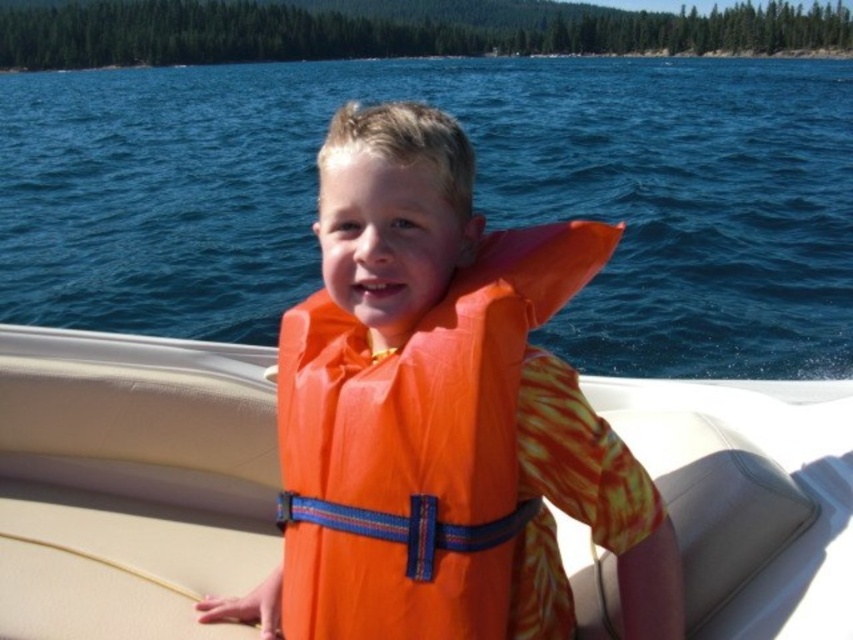
Does point (635, 276) come closer to viewer compared to point (846, 477)?

That is False.

Is orange life vest at center further to camera compared to orange fabric life vest at center?

No, it is not.

Is point (772, 156) behind point (45, 330)?

That is True.

The height and width of the screenshot is (640, 853). What are the coordinates of `orange life vest at center` in the screenshot? It's located at (474, 196).

Between point (509, 248) and point (792, 400), which one is positioned in front?

Point (509, 248)

Does point (544, 253) come behind point (115, 424)?

No, (544, 253) is closer to viewer.

In the scene shown: Measure the distance between point (445, 282) and camera.

1.74 meters

At what (x,y) coordinates should I click in order to perform the action: click on orange rubber life vest at center. Please return your answer as a coordinate pair (x, y). This screenshot has width=853, height=640. Looking at the image, I should click on coord(413,401).

From the picture: Which is below, orange life vest at center or orange rubber life vest at center?

orange rubber life vest at center

Does point (155, 97) lie in front of point (289, 560)?

No.

Where is `orange life vest at center`? The image size is (853, 640). orange life vest at center is located at coordinates (474, 196).